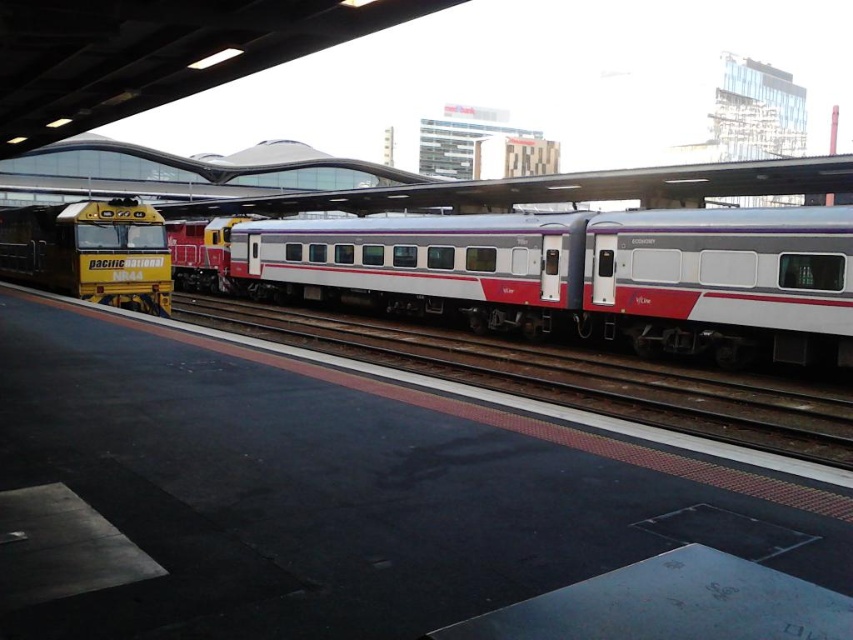
Question: Which object appears closest to the camera in this image?

Choices:
 (A) silver metallic train car at center
 (B) yellow painted metal locomotive at left

Answer: (A)

Question: Which object is closer to the camera taking this photo?

Choices:
 (A) silver metallic train car at center
 (B) metallic train track at center
 (C) yellow painted metal locomotive at left

Answer: (B)

Question: Is silver metallic train car at center closer to camera compared to yellow painted metal locomotive at left?

Choices:
 (A) no
 (B) yes

Answer: (B)

Question: Does silver metallic train car at center appear under yellow painted metal locomotive at left?

Choices:
 (A) yes
 (B) no

Answer: (A)

Question: Which point is farther to the camera?

Choices:
 (A) (786, 445)
 (B) (769, 250)

Answer: (B)

Question: Is metallic train track at center in front of yellow painted metal locomotive at left?

Choices:
 (A) no
 (B) yes

Answer: (B)